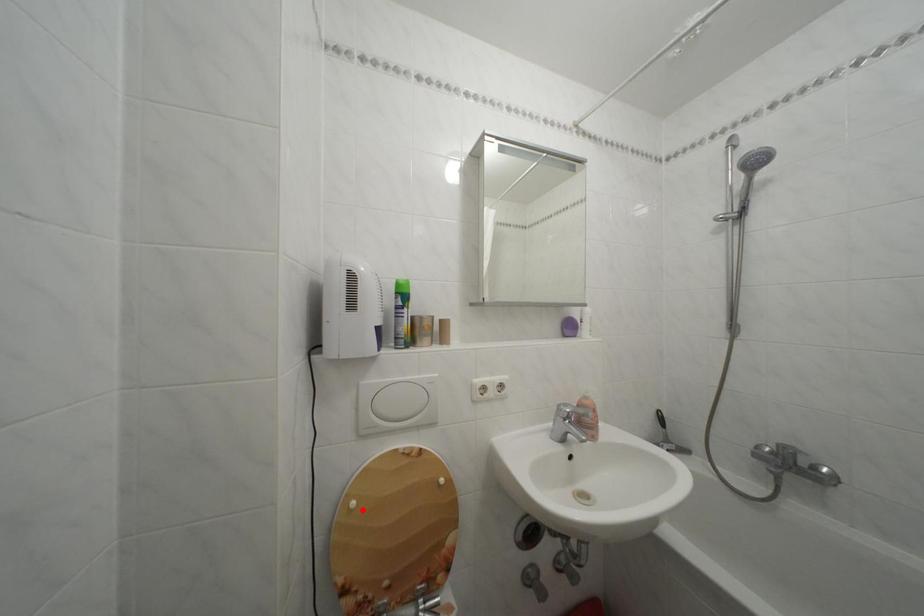
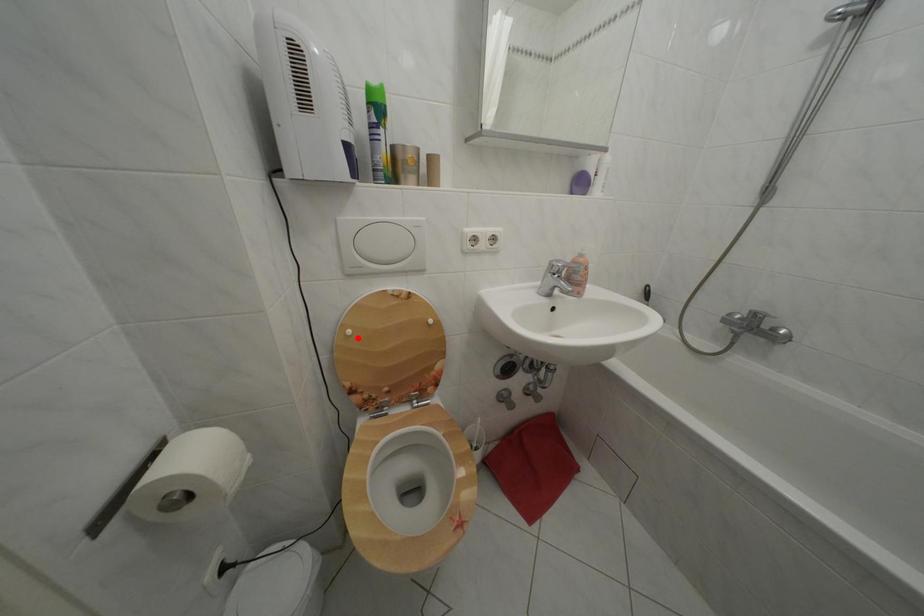
I am providing you with two images of the same scene from different viewpoints. A red point is marked on the first image and another point is marked on the second image. Is the red point in image1 aligned with the point shown in image2?

Yes